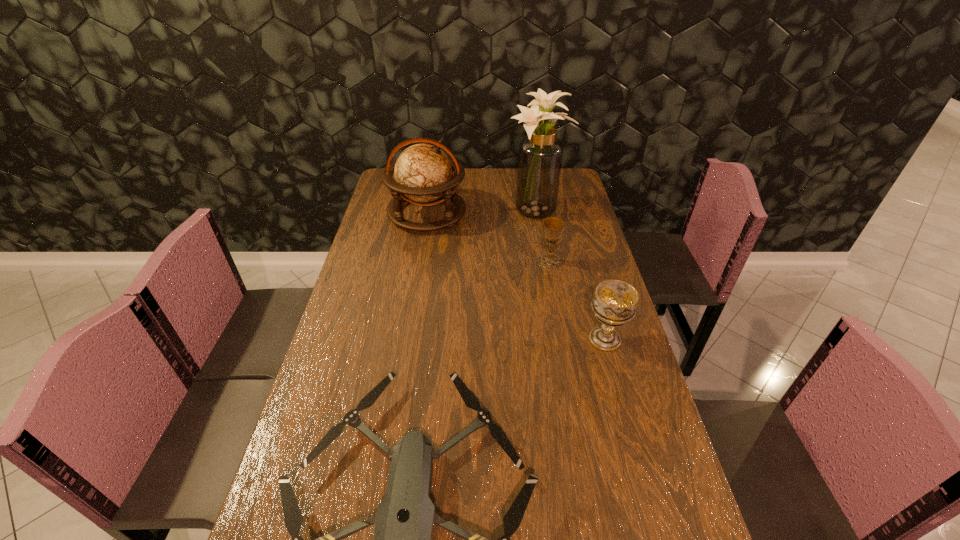
Find the location of a particular element. The image size is (960, 540). the tallest object is located at coordinates (540, 156).

Identify the location of globe. (423, 173).

Image resolution: width=960 pixels, height=540 pixels. Identify the location of the right chalice. (615, 302).

This screenshot has width=960, height=540. What are the coordinates of `the fourth farthest object` in the screenshot? It's located at (615, 302).

You are a GUI agent. You are given a task and a screenshot of the screen. Output one action in this format:
    pyautogui.click(x=<x>, y=<y>)
    Task: Click on the left chalice
    The height and width of the screenshot is (540, 960).
    Given the screenshot: What is the action you would take?
    pyautogui.click(x=553, y=226)

Locate an element on the screen. the third nearest object is located at coordinates (553, 226).

Find the location of a particular element. blank space located 0.280m on the left of the flower arrangement is located at coordinates (437, 212).

Image resolution: width=960 pixels, height=540 pixels. Find the location of `vacant area situated on the right of the globe`. vacant area situated on the right of the globe is located at coordinates (518, 213).

In order to click on free region located on the front of the nearer chalice in this screenshot , I will do `click(615, 376)`.

The width and height of the screenshot is (960, 540). Find the location of `vacant space located on the left of the third nearest object`. vacant space located on the left of the third nearest object is located at coordinates (444, 262).